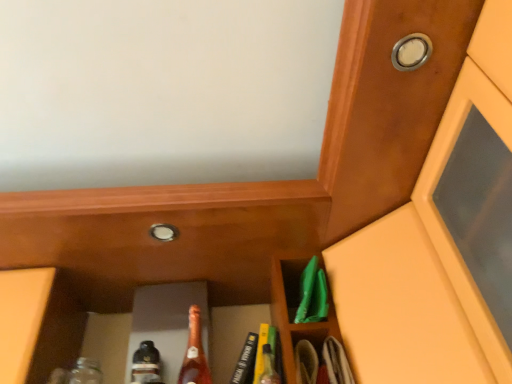
You are a GUI agent. You are given a task and a screenshot of the screen. Output one action in this format:
    pyautogui.click(x=<x>, y=<y>)
    Task: Click on the vacant area to the left of metallic silver knob at upper right, marked as the first knob in a top-to-bottom arrangement
    This screenshot has width=512, height=384.
    Given the screenshot: What is the action you would take?
    pyautogui.click(x=375, y=64)